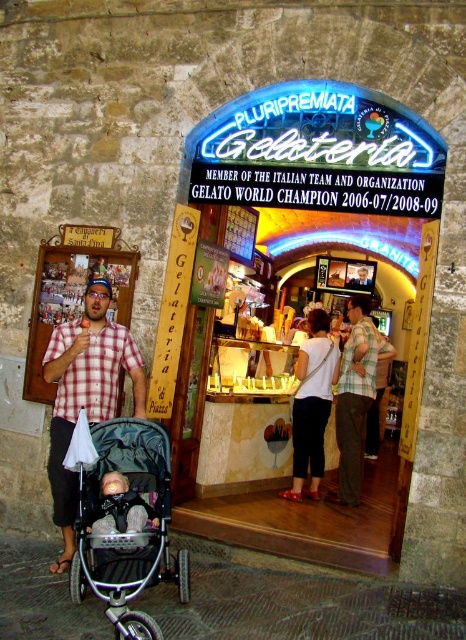
You are a customer looking at the gelateria staff. You see a checkered fabric shirt at left and a plaid shirt at center. Which staff member is closer to the floor?

The checkered fabric shirt at left is below plaid shirt at center, so the staff member wearing the checkered fabric shirt at left is closer to the floor.

You are a photographer planning to take a photo of the gelateria entrance. You notice a person wearing a checkered fabric shirt at left and a soft beige fabric baby carriage at lower left. If you want to ensure both subjects are fully visible in the frame, which subject should you position closer to the camera?

The checkered fabric shirt at left might be wider than the soft beige fabric baby carriage at lower left, so positioning the checkered fabric shirt at left closer to the camera would help ensure both are fully visible.